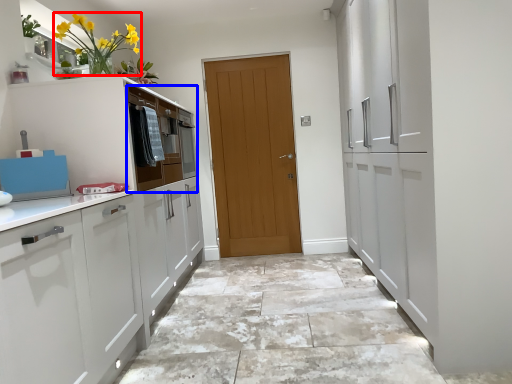
Question: Which object is closer to the camera taking this photo, floral arrangement (highlighted by a red box) or drawer (highlighted by a blue box)?

Choices:
 (A) floral arrangement
 (B) drawer

Answer: (A)